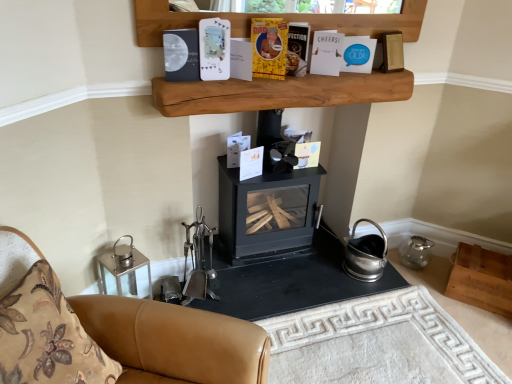
What do you see at coordinates (326, 53) in the screenshot? The height and width of the screenshot is (384, 512). I see `white paper at upper center, positioned as the second paperback book in right-to-left order` at bounding box center [326, 53].

What do you see at coordinates (297, 49) in the screenshot? I see `yellow paper-covered book at upper center, which ranks as the fourth paperback book in left-to-right order` at bounding box center [297, 49].

In order to click on wooden box at lower right, the second shelf viewed from the left in this screenshot , I will do `click(481, 279)`.

This screenshot has height=384, width=512. Find the location of `white paper at upper center, positioned as the second paperback book in right-to-left order`. white paper at upper center, positioned as the second paperback book in right-to-left order is located at coordinates (326, 53).

Can you confirm if floral fabric cushion at lower left is taller than yellow paper at upper center, which is counted as the 4th paperback book, starting from the right?

Yes, floral fabric cushion at lower left is taller than yellow paper at upper center, which is counted as the 4th paperback book, starting from the right.

You are a GUI agent. You are given a task and a screenshot of the screen. Output one action in this format:
    pyautogui.click(x=<x>, y=<y>)
    Task: Click on the pillow below the yellow paper at upper center, which is the 3th paperback book in left-to-right order (from the image's perspective)
    This screenshot has width=512, height=384.
    Given the screenshot: What is the action you would take?
    pyautogui.click(x=47, y=336)

Considering the positions of points (38, 319) and (263, 21), is point (38, 319) closer to camera compared to point (263, 21)?

Yes, it is.

Is floral fabric cushion at lower left further to the viewer compared to yellow paper at upper center, which is counted as the 4th paperback book, starting from the right?

No, floral fabric cushion at lower left is closer to the camera.

Between natural wood shelf at upper center, which ranks as the 2th shelf in right-to-left order, and wooden box at lower right, positioned as the 1th shelf in back-to-front order, which one has smaller width?

Thinner between the two is natural wood shelf at upper center, which ranks as the 2th shelf in right-to-left order.

Is natural wood shelf at upper center, which is the second shelf from back to front, situated inside wooden box at lower right, positioned as the 1th shelf in back-to-front order, or outside?

natural wood shelf at upper center, which is the second shelf from back to front, is located beyond the bounds of wooden box at lower right, positioned as the 1th shelf in back-to-front order.

Visually, is natural wood shelf at upper center, which ranks as the 2th shelf in right-to-left order, positioned to the left or to the right of wooden box at lower right, the 2th shelf viewed from the top?

natural wood shelf at upper center, which ranks as the 2th shelf in right-to-left order, is to the left of wooden box at lower right, the 2th shelf viewed from the top.

From the picture: Is natural wood shelf at upper center, which ranks as the 2th shelf in right-to-left order, closer to camera compared to wooden box at lower right, which appears as the 1th shelf when viewed from the right?

Yes, natural wood shelf at upper center, which ranks as the 2th shelf in right-to-left order, is closer to the viewer.

Between wooden box at lower right, the 2th shelf viewed from the top, and blue paper at upper center, the 6th paperback book positioned from the left, which one has smaller size?

With smaller size is blue paper at upper center, the 6th paperback book positioned from the left.

Locate an element on the screen. paperback book that is the 1st one when counting leftward from the wooden box at lower right, positioned as the 1th shelf in back-to-front order is located at coordinates (358, 54).

Which of these two, wooden box at lower right, positioned as the 1th shelf in back-to-front order, or blue paper at upper center, the 6th paperback book positioned from the left, stands taller?

wooden box at lower right, positioned as the 1th shelf in back-to-front order.

Would you consider wooden box at lower right, which appears as the 1th shelf when viewed from the right, to be distant from blue paper at upper center, the 6th paperback book positioned from the left?

Yes, wooden box at lower right, which appears as the 1th shelf when viewed from the right, is far from blue paper at upper center, the 6th paperback book positioned from the left.

Could you tell me if yellow paper at upper center, which is the 3th paperback book in left-to-right order, is facing black matte wood burning stove at center?

No, yellow paper at upper center, which is the 3th paperback book in left-to-right order, is not oriented towards black matte wood burning stove at center.

Can you confirm if yellow paper at upper center, which is counted as the 4th paperback book, starting from the right, is thinner than black matte wood burning stove at center?

Indeed, yellow paper at upper center, which is counted as the 4th paperback book, starting from the right, has a lesser width compared to black matte wood burning stove at center.

Who is shorter, yellow paper at upper center, which is the 3th paperback book in left-to-right order, or black matte wood burning stove at center?

yellow paper at upper center, which is the 3th paperback book in left-to-right order, is shorter.

Is point (257, 44) more distant than point (290, 256)?

No, (257, 44) is closer to viewer.

Based on the photo, are white matte paper at upper center, positioned as the 5th paperback book in right-to-left order, and floral fabric cushion at lower left making contact?

There is a gap between white matte paper at upper center, positioned as the 5th paperback book in right-to-left order, and floral fabric cushion at lower left.

From the image's perspective, is white matte paper at upper center, positioned as the 5th paperback book in right-to-left order, below floral fabric cushion at lower left?

No, from the image's perspective, white matte paper at upper center, positioned as the 5th paperback book in right-to-left order, is not below floral fabric cushion at lower left.

Is white matte paper at upper center, positioned as the 5th paperback book in right-to-left order, further to camera compared to floral fabric cushion at lower left?

Yes, the depth of white matte paper at upper center, positioned as the 5th paperback book in right-to-left order, is greater than that of floral fabric cushion at lower left.

Is floral fabric cushion at lower left a part of white matte paper at upper center, positioned as the 5th paperback book in right-to-left order?

No, floral fabric cushion at lower left is not a part of white matte paper at upper center, positioned as the 5th paperback book in right-to-left order.

Is brown leather couch at lower left positioned with its back to wooden box at lower right, which appears as the second shelf when viewed from the front?

brown leather couch at lower left is not turned away from wooden box at lower right, which appears as the second shelf when viewed from the front.

Considering the relative positions of brown leather couch at lower left and wooden box at lower right, positioned as the 1th shelf in back-to-front order, in the image provided, is brown leather couch at lower left to the left of wooden box at lower right, positioned as the 1th shelf in back-to-front order, from the viewer's perspective?

Yes.

Is brown leather couch at lower left not near wooden box at lower right, which appears as the 1th shelf when viewed from the right?

brown leather couch at lower left is far away from wooden box at lower right, which appears as the 1th shelf when viewed from the right.

Consider the image. Between brown leather couch at lower left and wooden box at lower right, the second shelf viewed from the left, which one has less height?

wooden box at lower right, the second shelf viewed from the left, is shorter.

From a real-world perspective, is floral fabric cushion at lower left above or below yellow paper-covered book at upper center, placed as the 3th paperback book when sorted from right to left?

floral fabric cushion at lower left is below yellow paper-covered book at upper center, placed as the 3th paperback book when sorted from right to left.

In terms of size, does floral fabric cushion at lower left appear bigger or smaller than yellow paper-covered book at upper center, placed as the 3th paperback book when sorted from right to left?

In the image, floral fabric cushion at lower left appears to be larger than yellow paper-covered book at upper center, placed as the 3th paperback book when sorted from right to left.

Based on the photo, is floral fabric cushion at lower left thinner than yellow paper-covered book at upper center, which ranks as the fourth paperback book in left-to-right order?

Incorrect, the width of floral fabric cushion at lower left is not less than that of yellow paper-covered book at upper center, which ranks as the fourth paperback book in left-to-right order.

Is yellow paper-covered book at upper center, placed as the 3th paperback book when sorted from right to left, inside floral fabric cushion at lower left?

Definitely not — yellow paper-covered book at upper center, placed as the 3th paperback book when sorted from right to left, is not inside floral fabric cushion at lower left.

Locate an element on the screen. pillow in front of the yellow paper at upper center, which is the 3th paperback book in left-to-right order is located at coordinates (47, 336).

Find the location of a particular element. This screenshot has height=384, width=512. shelf on the left of wooden box at lower right, positioned as the 1th shelf in back-to-front order is located at coordinates (278, 93).

Looking at the image, which one is located further to floral fabric cushion at lower left, wooden box at lower right, the 2th shelf viewed from the top, or brown leather couch at lower left?

wooden box at lower right, the 2th shelf viewed from the top, is further to floral fabric cushion at lower left.

Based on their spatial positions, is white paper at upper center, positioned as the 5th paperback book in left-to-right order, or wooden box at lower right, which appears as the second shelf when viewed from the front, further from yellow paper at upper center, which is the 3th paperback book in left-to-right order?

Based on the image, wooden box at lower right, which appears as the second shelf when viewed from the front, appears to be further to yellow paper at upper center, which is the 3th paperback book in left-to-right order.

Based on their spatial positions, is yellow paper at upper center, which is the 3th paperback book in left-to-right order, or yellow paper-covered book at upper center, placed as the 3th paperback book when sorted from right to left, further from natural wood shelf at upper center, which is the second shelf from back to front?

Based on the image, yellow paper-covered book at upper center, placed as the 3th paperback book when sorted from right to left, appears to be further to natural wood shelf at upper center, which is the second shelf from back to front.

When comparing their distances from black matte wood burning stove at center, does brown leather couch at lower left or blue paper at upper center, the 1th paperback book when ordered from right to left, seem further?

brown leather couch at lower left is positioned further to the anchor black matte wood burning stove at center.

When comparing their distances from natural wood shelf at upper center, which ranks as the 2th shelf in right-to-left order, does yellow paper-covered book at upper center, which ranks as the fourth paperback book in left-to-right order, or wooden box at lower right, the second shelf viewed from the left, seem closer?

The object closer to natural wood shelf at upper center, which ranks as the 2th shelf in right-to-left order, is yellow paper-covered book at upper center, which ranks as the fourth paperback book in left-to-right order.

When comparing their distances from yellow paper-covered book at upper center, placed as the 3th paperback book when sorted from right to left, does blue paper at upper center, the 1th paperback book when ordered from right to left, or natural wood shelf at upper center, the 1th shelf when ordered from left to right, seem closer?

Based on the image, natural wood shelf at upper center, the 1th shelf when ordered from left to right, appears to be nearer to yellow paper-covered book at upper center, placed as the 3th paperback book when sorted from right to left.

When comparing their distances from blue paper at upper center, the 1th paperback book when ordered from right to left, does yellow paper-covered book at upper center, which ranks as the fourth paperback book in left-to-right order, or brown leather couch at lower left seem further?

brown leather couch at lower left.

Which object lies nearer to the anchor point wooden box at lower right, the 2th shelf viewed from the top, white matte paper at upper center, which is the 2th paperback book from left to right, or blue paper at upper center, the 6th paperback book positioned from the left?

Among the two, blue paper at upper center, the 6th paperback book positioned from the left, is located nearer to wooden box at lower right, the 2th shelf viewed from the top.

The height and width of the screenshot is (384, 512). What are the coordinates of `shelf between white paper at upper center, positioned as the second paperback book in right-to-left order, and floral fabric cushion at lower left, in the vertical direction` in the screenshot? It's located at (278, 93).

At what (x,y) coordinates should I click in order to perform the action: click on wood burning stove situated between brown leather couch at lower left and wooden box at lower right, which appears as the first shelf when ordered from the bottom, from left to right. Please return your answer as a coordinate pair (x, y). This screenshot has width=512, height=384. Looking at the image, I should click on (267, 213).

Image resolution: width=512 pixels, height=384 pixels. I want to click on shelf located between yellow paper at upper center, which is counted as the 4th paperback book, starting from the right, and blue paper at upper center, the 6th paperback book positioned from the left, in the left-right direction, so click(x=278, y=93).

Locate an element on the screen. The image size is (512, 384). pillow between white paper at upper center, positioned as the second paperback book in right-to-left order, and brown leather couch at lower left from top to bottom is located at coordinates (47, 336).